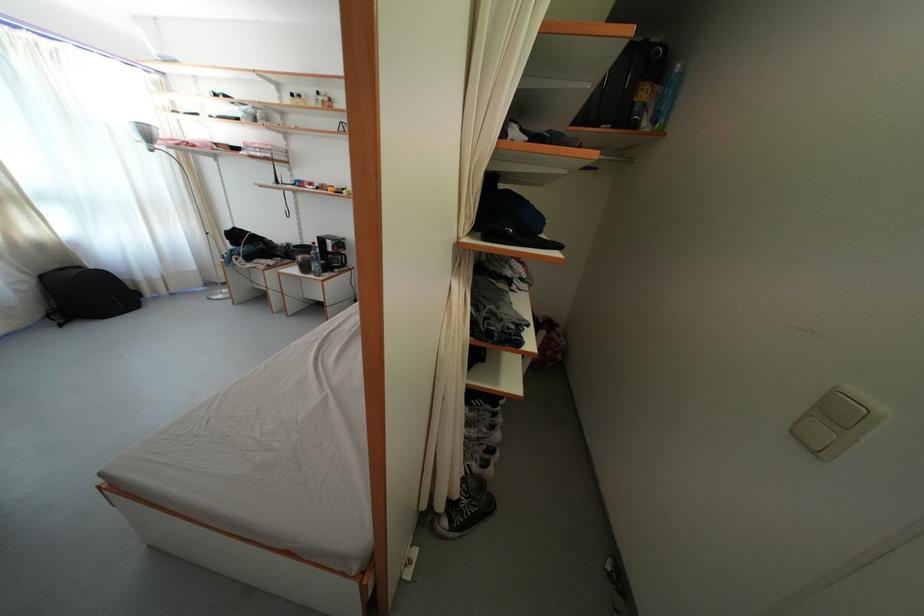
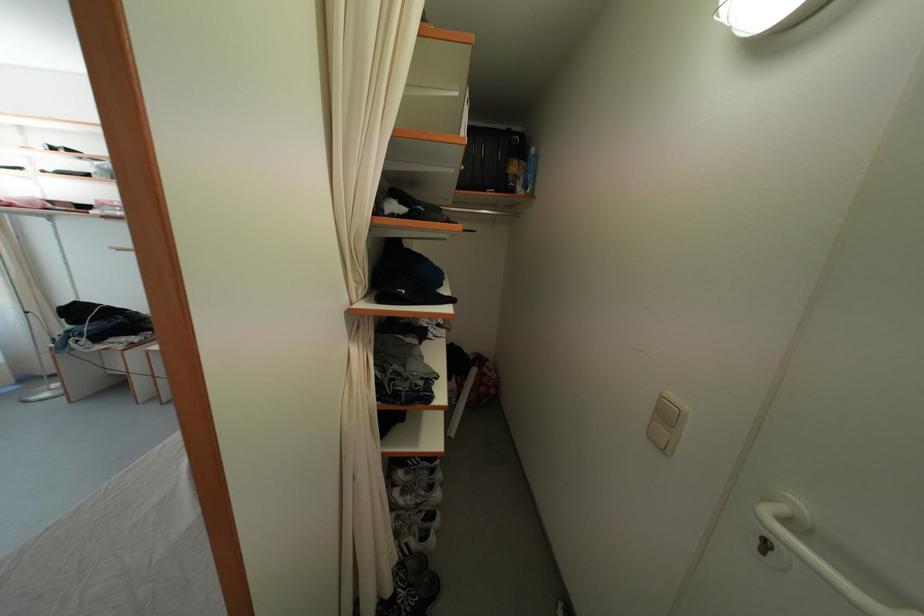
Where in the second image is the point corresponding to pixel 815 421 from the first image?

(659, 426)